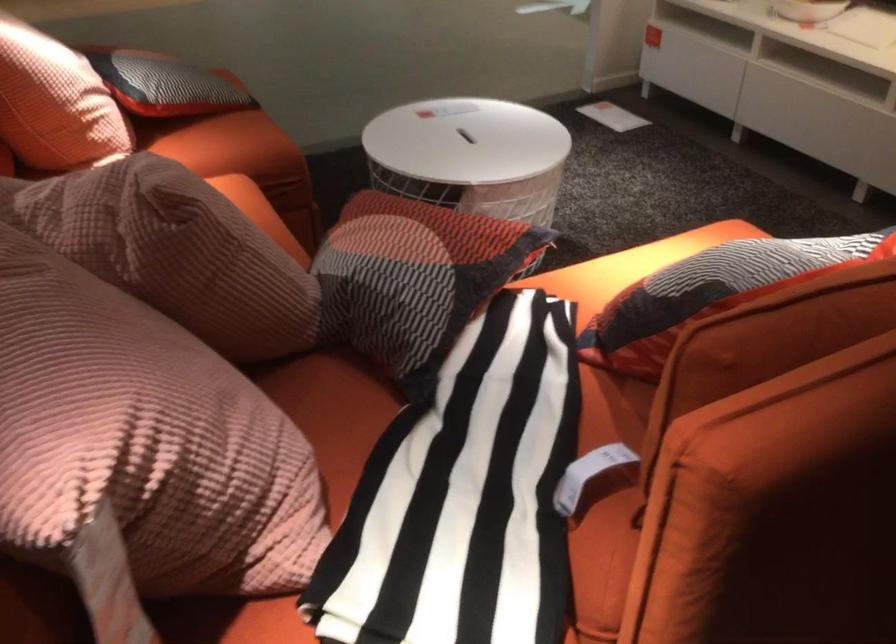
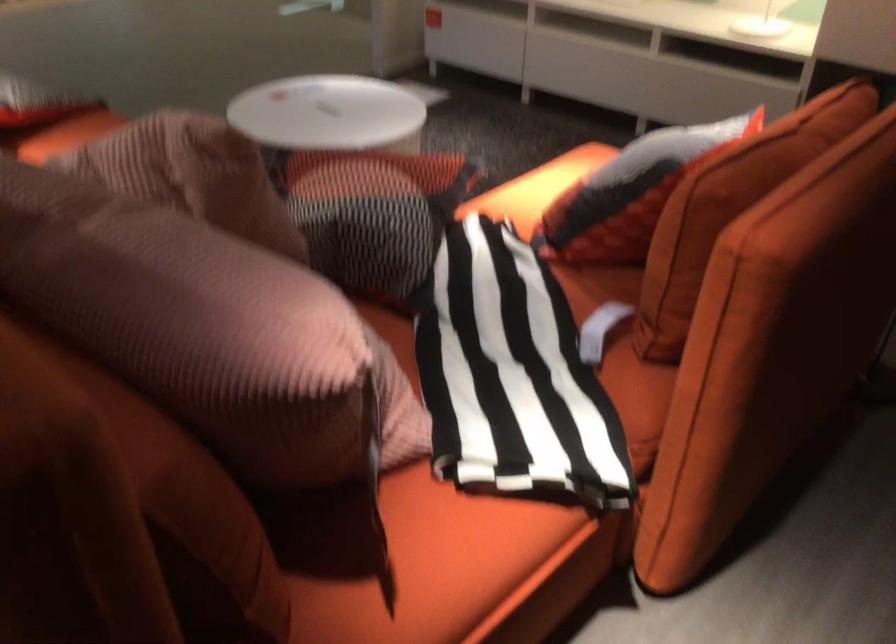
Question: What movement of the cameraman would produce the second image?

Choices:
 (A) Left
 (B) Right
 (C) Forward
 (D) Backward

Answer: (A)